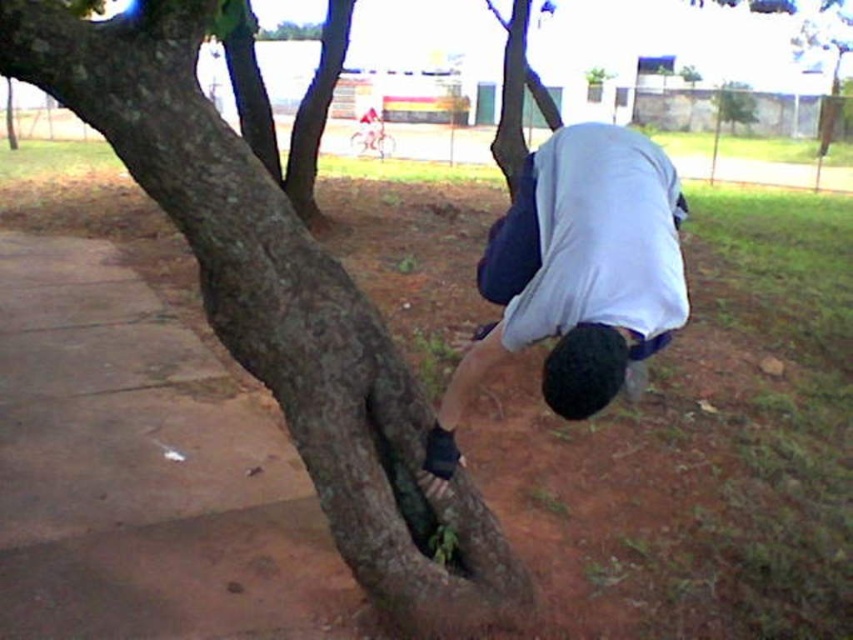
You are trying to climb the tree shown in the image. You have to choose between the brown rough tree trunk at center and the brown rough bark at center for better grip. Which one should you choose and why?

You should choose the brown rough bark at center because it is taller than the brown rough tree trunk at center, providing a better grip for climbing.

You are trying to climb the tree and need to decide which direction to go first. Based on the image, which tree trunk is positioned to the left side? Please choose between the brown rough tree trunk at center and the green rough bark tree at upper center.

The brown rough tree trunk at center is positioned to the left of the green rough bark tree at upper center.

You are a photographer trying to capture a photo of the brown rough tree trunk at center and the white matte shirt at center. From your current position, which object is located to the left?

The brown rough tree trunk at center is positioned on the left side of the white matte shirt at center, so the brown rough tree trunk at center is to the left.